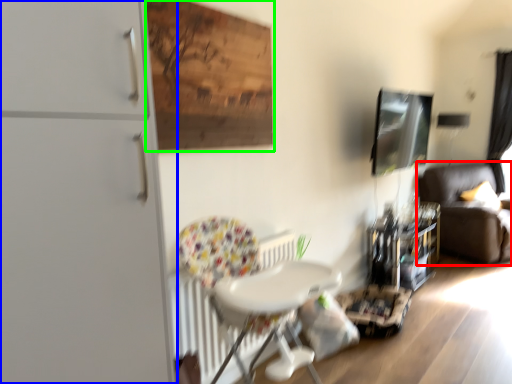
Question: Which is farther away from studio couch (highlighted by a red box)? dresser (highlighted by a blue box) or plywood (highlighted by a green box)?

Choices:
 (A) dresser
 (B) plywood

Answer: (A)